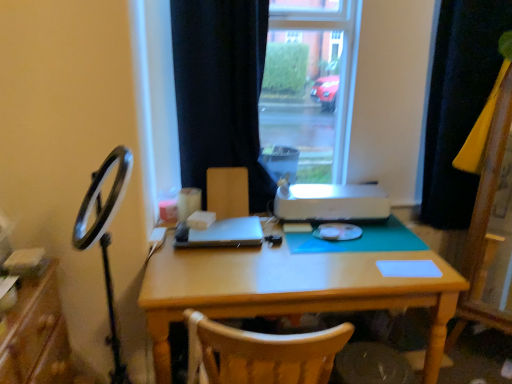
At what (x,y) coordinates should I click in order to perform the action: click on blank space situated above white matte notepad at center (from a real-world perspective). Please return your answer as a coordinate pair (x, y). Looking at the image, I should click on (399, 266).